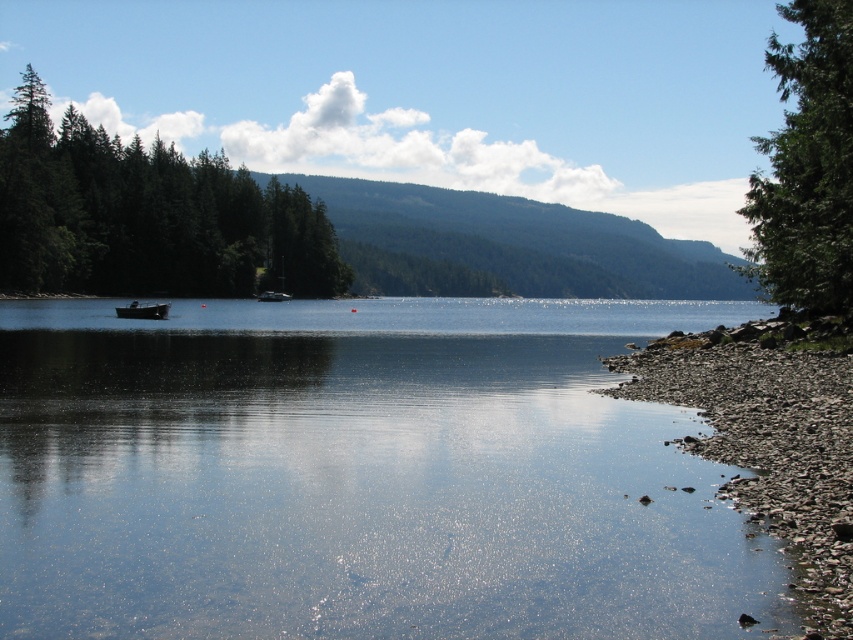
This screenshot has height=640, width=853. In order to click on green forested mountain at center in this screenshot , I will do `click(527, 241)`.

You are a GUI agent. You are given a task and a screenshot of the screen. Output one action in this format:
    pyautogui.click(x=<x>, y=<y>)
    Task: Click on the green forested mountain at center
    
    Given the screenshot: What is the action you would take?
    pyautogui.click(x=527, y=241)

Does clear water at center have a lesser width compared to smooth pebbles at lower right?

No.

Between clear water at center and smooth pebbles at lower right, which one is positioned lower?

smooth pebbles at lower right is below.

Who is more distant from viewer, (383,310) or (766,429)?

The point (383,310) is behind.

At what (x,y) coordinates should I click in order to perform the action: click on clear water at center. Please return your answer as a coordinate pair (x, y). The height and width of the screenshot is (640, 853). Looking at the image, I should click on (358, 476).

Who is taller, clear water at center or green matte trees at left?

Standing taller between the two is green matte trees at left.

Is point (207, 401) behind point (294, 209)?

That is False.

This screenshot has height=640, width=853. What do you see at coordinates (358, 476) in the screenshot?
I see `clear water at center` at bounding box center [358, 476].

Locate an element on the screen. clear water at center is located at coordinates (358, 476).